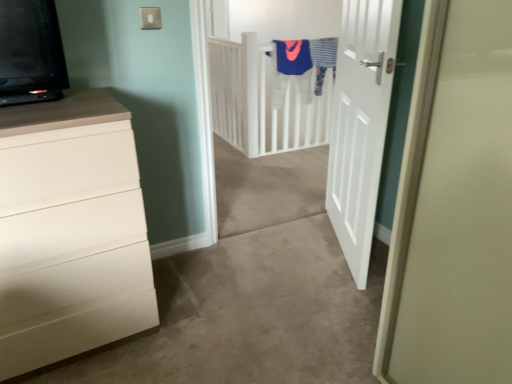
Identify the location of vacant space underneath blue fabric robe at upper center (from a real-world perspective). (287, 147).